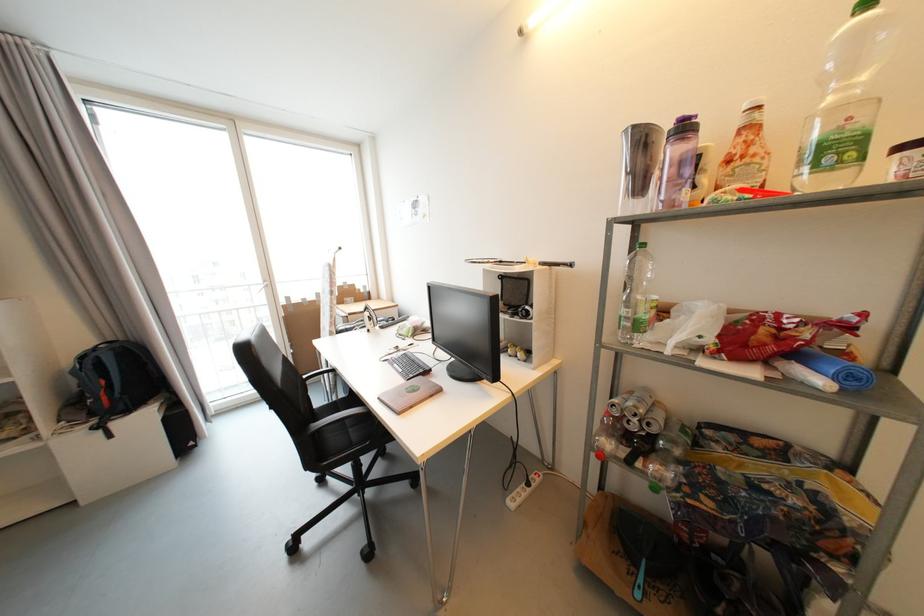
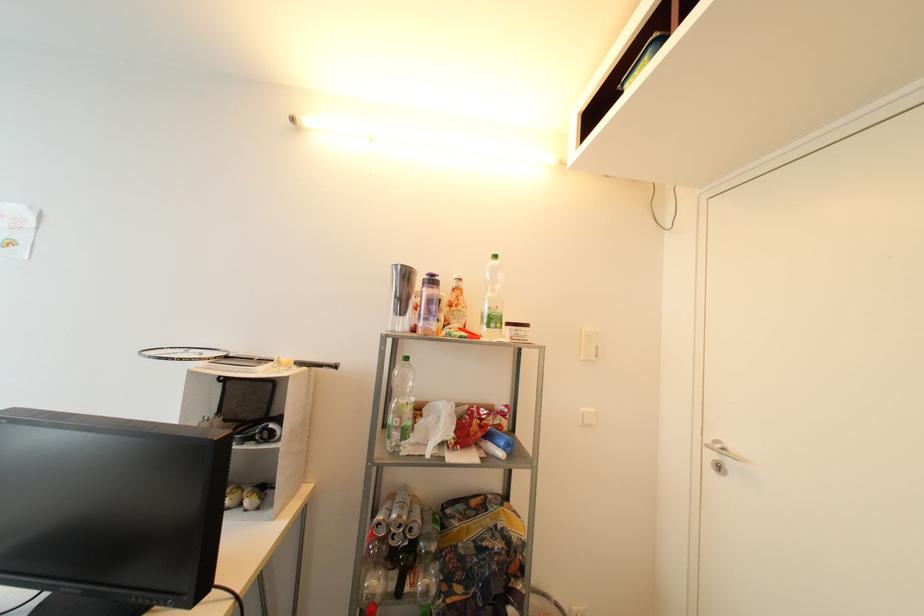
Find the pixel in the second image that matches (x=689, y=130) in the first image.

(438, 283)